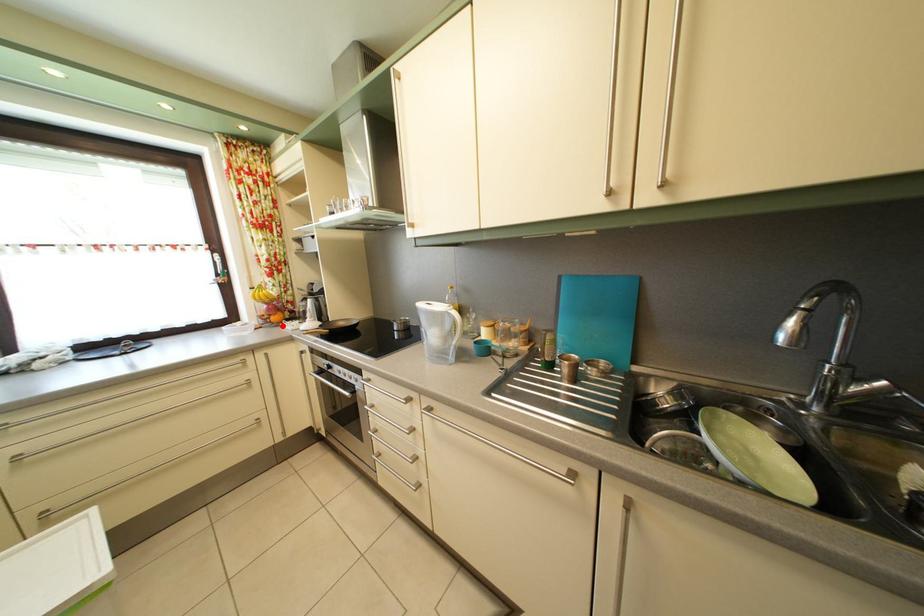
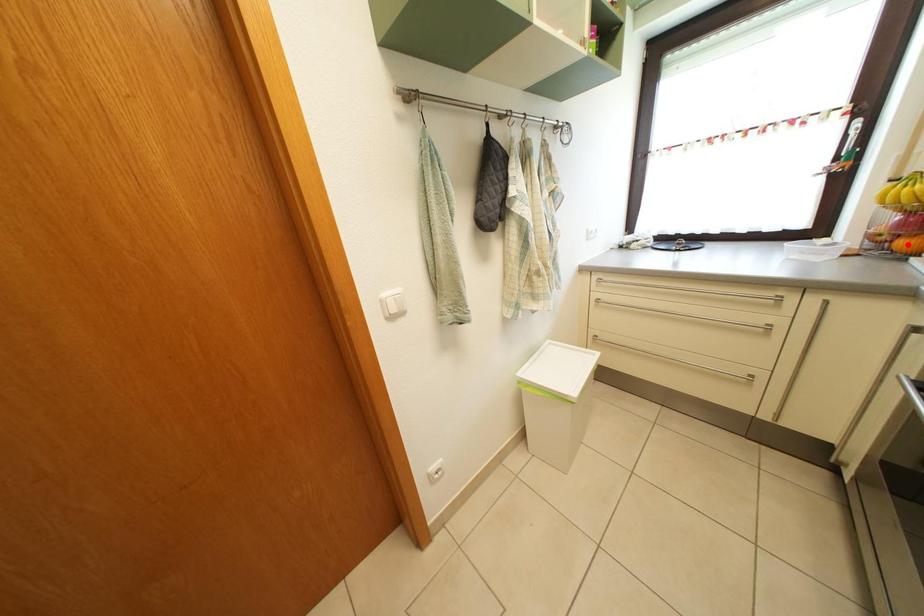
I am providing you with two images of the same scene from different viewpoints. A red point is marked on the first image and another point is marked on the second image. Are the points marked in image1 and image2 representing the same 3D position?

No